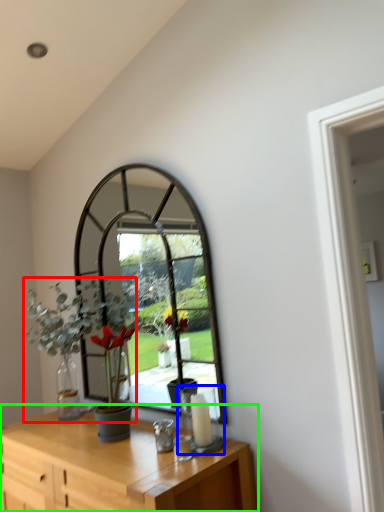
Question: Considering the real-world distances, which object is farthest from houseplant (highlighted by a red box)? candle holder (highlighted by a blue box) or table (highlighted by a green box)?

Choices:
 (A) candle holder
 (B) table

Answer: (A)